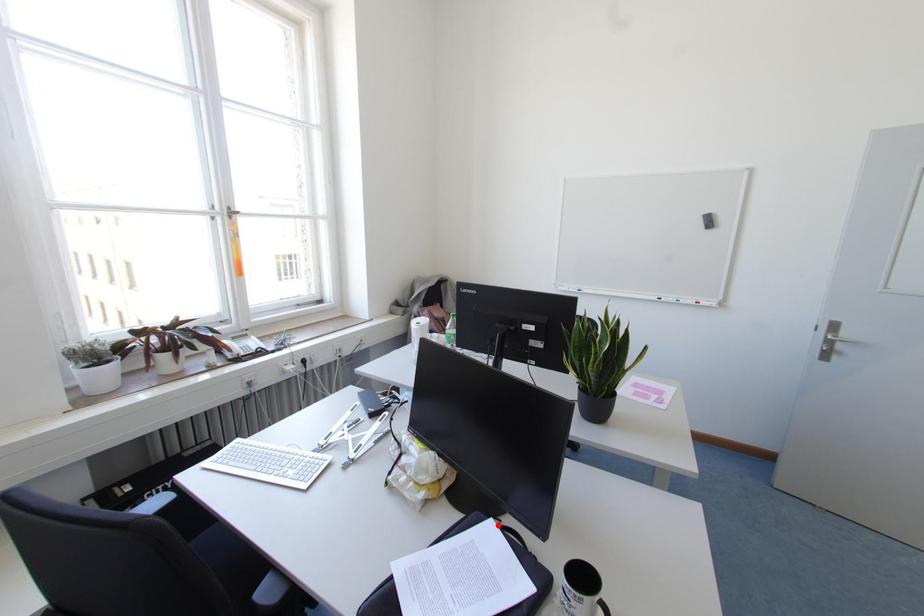
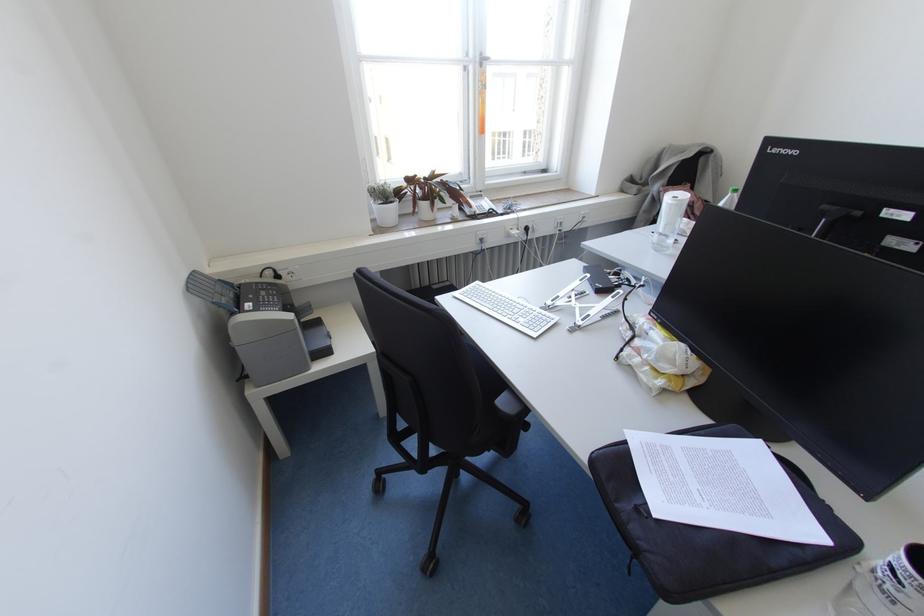
Question: I am providing you with two images of the same scene from different viewpoints. Image1 has a red point marked. In image2, the corresponding 3D location appears at what relative position? Reply with the corresponding letter.

Choices:
 (A) Closer
 (B) Farther

Answer: (A)